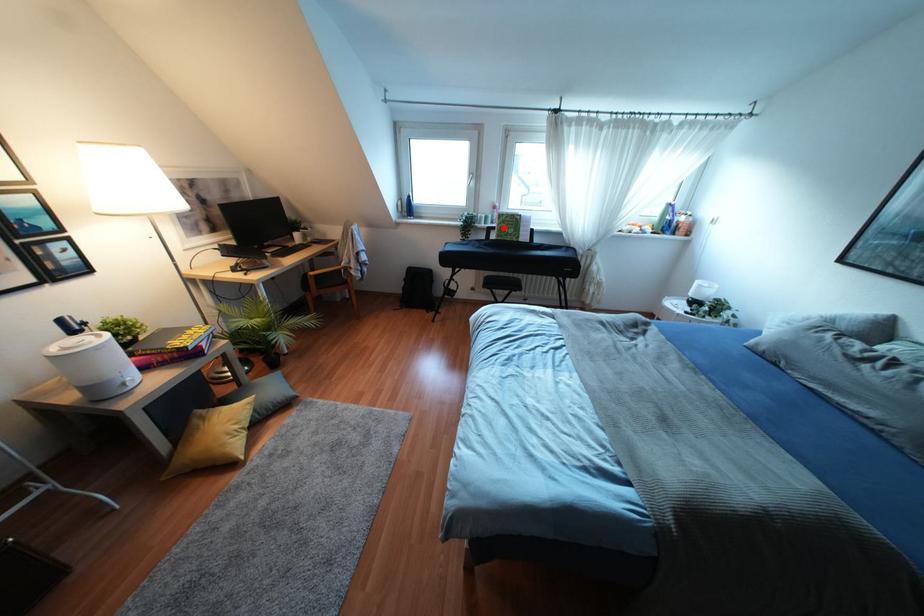
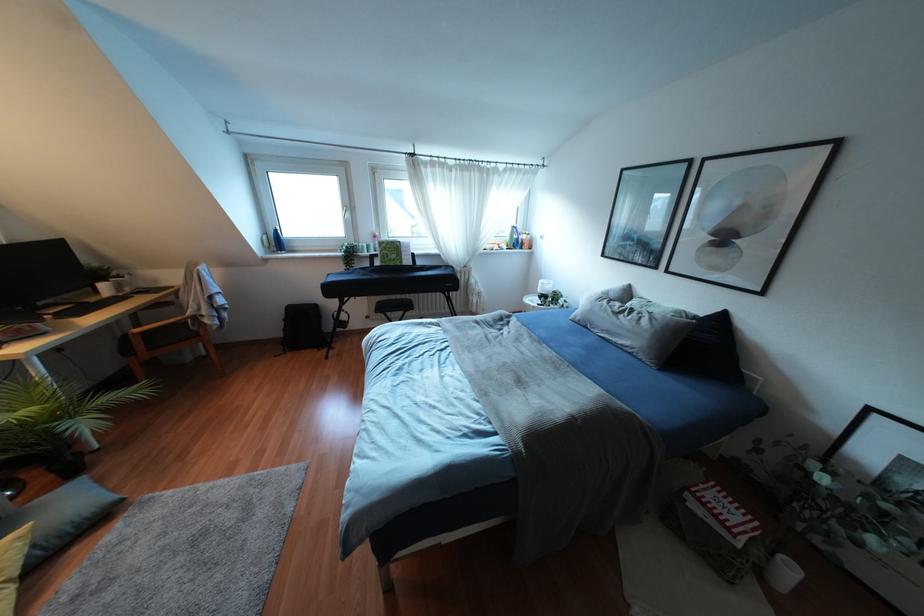
Question: A red point is marked in image1. In image2, is the corresponding 3D point closer to the camera or farther? Reply with the corresponding letter.

Choices:
 (A) The corresponding 3D point is closer.
 (B) The corresponding 3D point is farther.

Answer: (B)